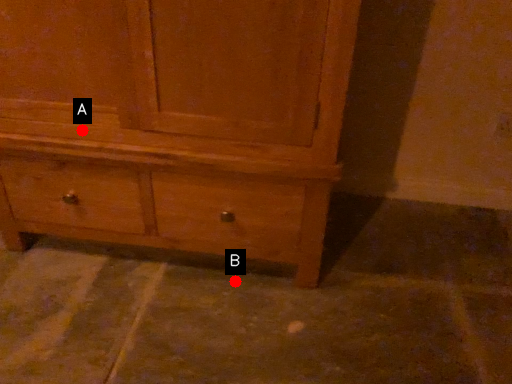
Question: Two points are circled on the image, labeled by A and B beside each circle. Among these points, which one is nearest to the camera?

Choices:
 (A) A is closer
 (B) B is closer

Answer: (A)